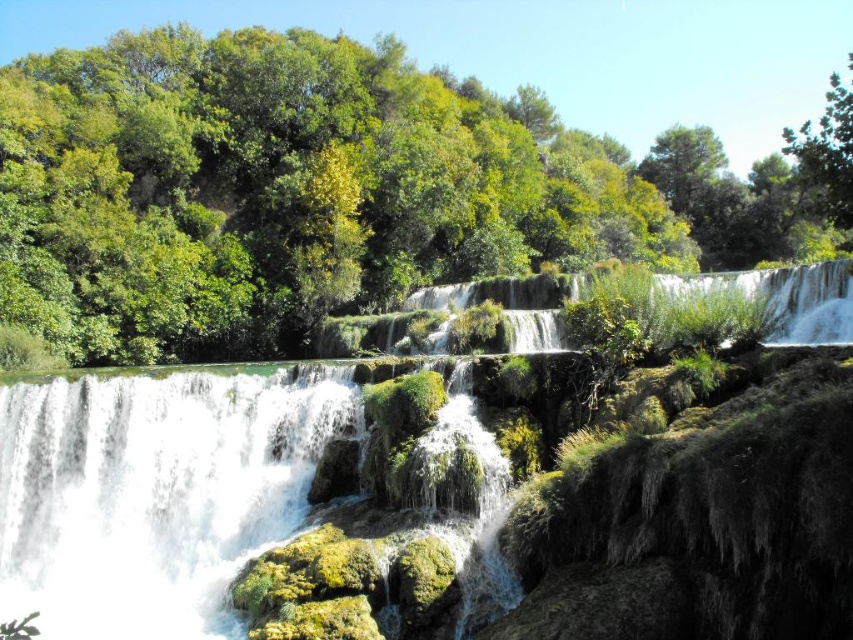
Question: Does green leafy tree at upper center lie in front of white frothy water at center?

Choices:
 (A) yes
 (B) no

Answer: (B)

Question: Among these objects, which one is farthest from the camera?

Choices:
 (A) white frothy water at center
 (B) green leafy tree at upper right
 (C) green leafy tree at upper center

Answer: (C)

Question: Is white frothy water at center to the right of green leafy tree at upper right from the viewer's perspective?

Choices:
 (A) yes
 (B) no

Answer: (B)

Question: Which point is closer to the camera?

Choices:
 (A) (834, 182)
 (B) (374, 100)

Answer: (A)

Question: Does green leafy tree at upper center have a greater width compared to green leafy tree at upper right?

Choices:
 (A) yes
 (B) no

Answer: (B)

Question: Which of these objects is positioned farthest from the white frothy water at center?

Choices:
 (A) green leafy tree at upper right
 (B) green leafy tree at upper center

Answer: (B)